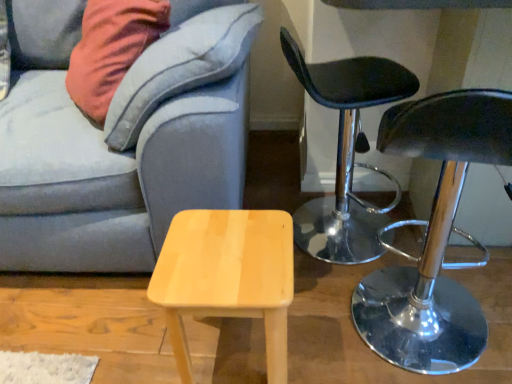
Question: From the image's perspective, is velvet gray couch at lower left positioned above or below shiny chrome stool at right, which ranks as the second chair in back-to-front order?

Choices:
 (A) above
 (B) below

Answer: (A)

Question: Considering the positions of velvet gray couch at lower left and shiny chrome stool at right, which ranks as the second chair in back-to-front order, in the image, is velvet gray couch at lower left taller or shorter than shiny chrome stool at right, which ranks as the second chair in back-to-front order,?

Choices:
 (A) tall
 (B) short

Answer: (A)

Question: Based on their relative distances, which object is farther from the shiny chrome stool at right, which ranks as the second chair in back-to-front order?

Choices:
 (A) velvet gray couch at lower left
 (B) light wood stool at center
 (C) black leather stool at right, which ranks as the first chair in back-to-front order

Answer: (A)

Question: Considering the real-world distances, which object is farthest from the black leather stool at right, which is counted as the 2th chair, starting from the front?

Choices:
 (A) velvet gray couch at lower left
 (B) light wood stool at center
 (C) shiny chrome stool at right, which ranks as the second chair in back-to-front order

Answer: (A)